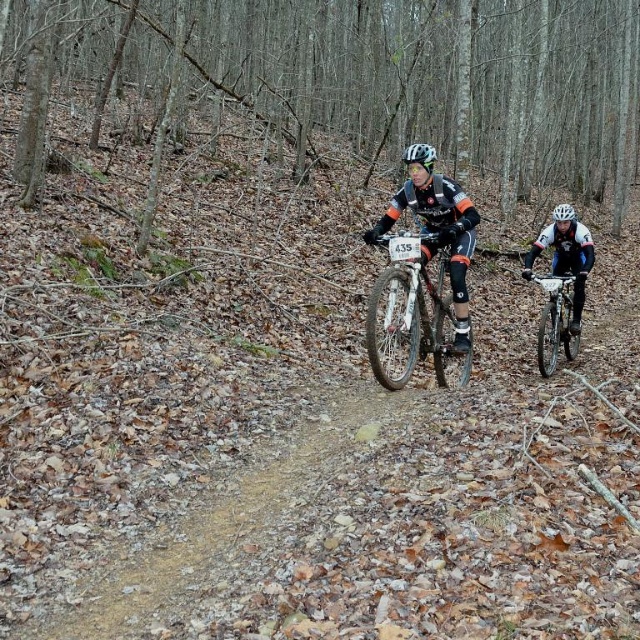
You are a photographer positioned at the camera location. You want to capture a closeup shot of the white matte helmet at upper right. Given that your camera can focus on objects within 5 meters, will you be able to take the photo without moving your position?

The white matte helmet at upper right is 7.12 meters away from the camera, which is beyond the 5 meter focus range. Therefore, you cannot take a closeup shot without moving closer.

You are a photographer positioned at the edge of the forest trail. You want to capture a photo that includes both the shiny metallic bicycle at center and the white matte helmet at center. Which object should you adjust your camera focus on first if you want to ensure the smaller object is in sharp focus?

The shiny metallic bicycle at center is smaller than the white matte helmet at center, so you should focus on the shiny metallic bicycle at center first to ensure it is in sharp focus.

From the picture: You are a photographer trying to capture a closeup shot of the shiny metallic bicycle at center and the white matte bicycle helmet at center. If you want to make sure both objects are in focus, which one should you adjust the camera focus on first?

The shiny metallic bicycle at center has a smaller size compared to white matte bicycle helmet at center, so you should focus on the smaller object first to ensure both are in focus.